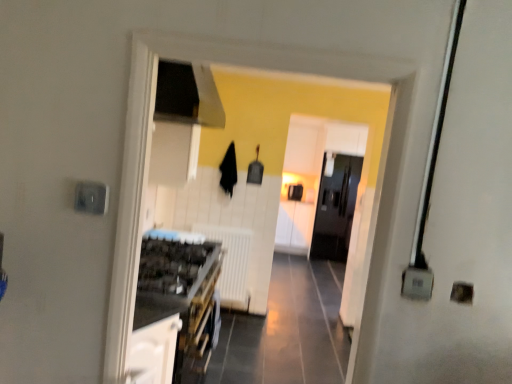
Question: Can you confirm if white glossy cabinet at center, which appears as the first cabinetry when viewed from the back, is bigger than white matte radiator at center?

Choices:
 (A) yes
 (B) no

Answer: (A)

Question: Does white glossy cabinet at center, which appears as the 2th cabinetry when viewed from the front, have a smaller size compared to white matte radiator at center?

Choices:
 (A) no
 (B) yes

Answer: (A)

Question: Can you confirm if white glossy cabinet at center, which appears as the 2th cabinetry when viewed from the front, is shorter than white matte radiator at center?

Choices:
 (A) yes
 (B) no

Answer: (B)

Question: From the image's perspective, is white glossy cabinet at center, which appears as the 2th cabinetry when viewed from the front, above white matte radiator at center?

Choices:
 (A) no
 (B) yes

Answer: (B)

Question: Is white glossy cabinet at center, the second cabinetry in the left-to-right sequence, facing away from white matte radiator at center?

Choices:
 (A) yes
 (B) no

Answer: (B)

Question: Considering the relative positions of white glossy cabinet at center, the 1th cabinetry viewed from the right, and white matte radiator at center in the image provided, is white glossy cabinet at center, the 1th cabinetry viewed from the right, behind white matte radiator at center?

Choices:
 (A) no
 (B) yes

Answer: (B)

Question: From the image's perspective, is white glossy cabinet at center, the second cabinetry in the left-to-right sequence, below black glossy refrigerator at center?

Choices:
 (A) no
 (B) yes

Answer: (B)

Question: Can black glossy refrigerator at center be found inside white glossy cabinet at center, which appears as the 2th cabinetry when viewed from the front?

Choices:
 (A) yes
 (B) no

Answer: (B)

Question: Does white glossy cabinet at center, the second cabinetry in the left-to-right sequence, come in front of black glossy refrigerator at center?

Choices:
 (A) no
 (B) yes

Answer: (A)

Question: Does white glossy cabinet at center, the 1th cabinetry viewed from the right, appear on the left side of black glossy refrigerator at center?

Choices:
 (A) no
 (B) yes

Answer: (B)

Question: Does white glossy cabinet at center, which appears as the first cabinetry when viewed from the back, have a lesser height compared to black glossy refrigerator at center?

Choices:
 (A) no
 (B) yes

Answer: (B)

Question: Is black glossy refrigerator at center at the back of white glossy cabinet at center, the 1th cabinetry viewed from the right?

Choices:
 (A) no
 (B) yes

Answer: (A)

Question: Is white glossy cabinet at lower left, positioned as the 1th cabinetry in left-to-right order, located within white matte radiator at center?

Choices:
 (A) yes
 (B) no

Answer: (B)